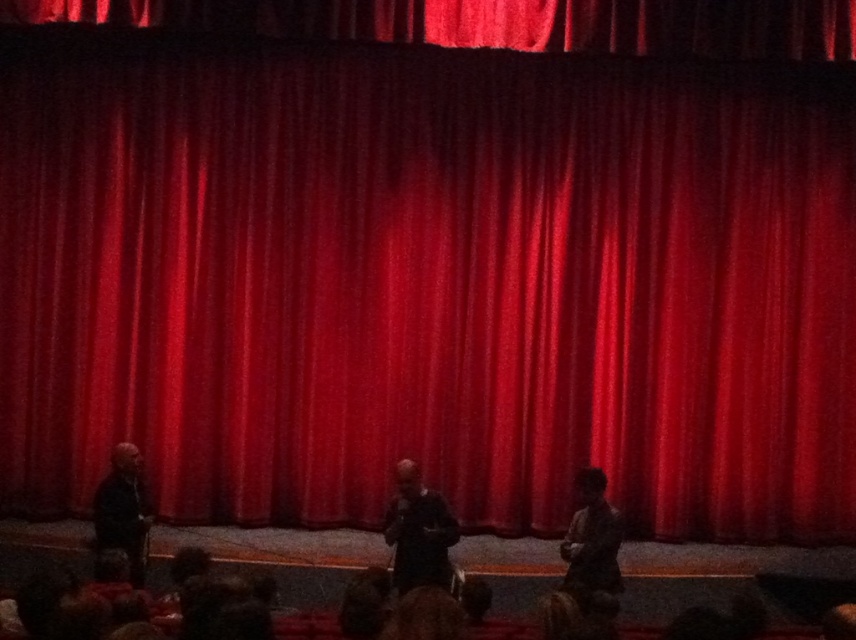
Question: In this image, where is dark gray shirt at center located relative to dark gray suit at left?

Choices:
 (A) left
 (B) right

Answer: (B)

Question: Estimate the real-world distances between objects in this image. Which object is closer to the dark gray suit at left?

Choices:
 (A) dark gray shirt at center
 (B) camouflage-patterned shirt at lower right

Answer: (A)

Question: Among these objects, which one is farthest from the camera?

Choices:
 (A) dark gray shirt at center
 (B) camouflage-patterned shirt at lower right

Answer: (A)

Question: Considering the relative positions of dark gray shirt at center and dark gray suit at left in the image provided, where is dark gray shirt at center located with respect to dark gray suit at left?

Choices:
 (A) right
 (B) left

Answer: (A)

Question: Which object is farther from the camera taking this photo?

Choices:
 (A) dark gray shirt at center
 (B) camouflage-patterned shirt at lower right

Answer: (A)

Question: From the image, what is the correct spatial relationship of dark gray shirt at center in relation to dark gray suit at left?

Choices:
 (A) right
 (B) left

Answer: (A)